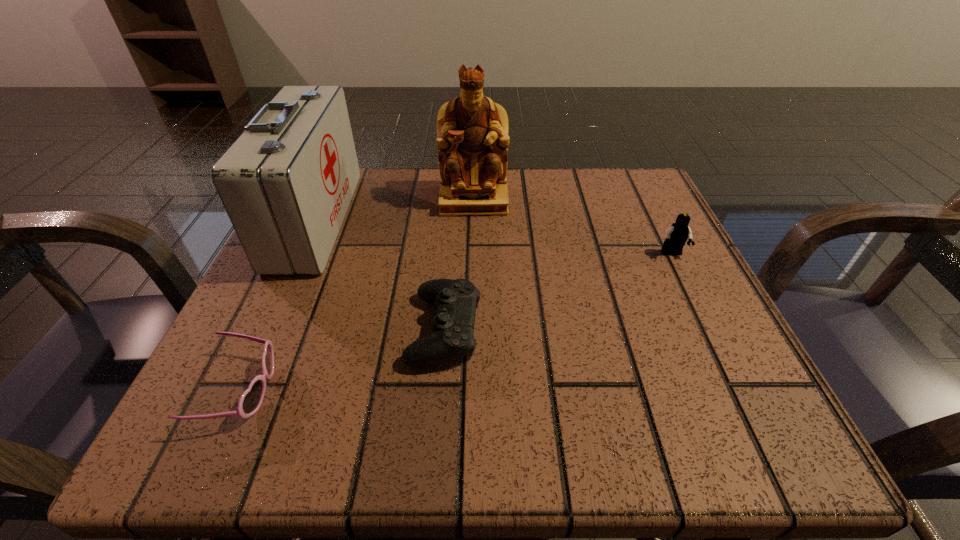
Find the location of a particular element. This screenshot has height=540, width=960. free space located on the front-facing side of the sunglasses is located at coordinates (497, 390).

This screenshot has height=540, width=960. Identify the location of figurine that is at the far edge. (472, 138).

I want to click on the first-aid kit that is at the far edge, so click(x=286, y=183).

Image resolution: width=960 pixels, height=540 pixels. What are the coordinates of `object at the near edge` in the screenshot? It's located at (251, 400).

Locate an element on the screen. Image resolution: width=960 pixels, height=540 pixels. the first-aid kit at the left edge is located at coordinates (286, 183).

Identify the location of sunglasses located in the left edge section of the desktop. This screenshot has height=540, width=960. (251, 400).

Find the location of `object present at the right edge`. object present at the right edge is located at coordinates (676, 236).

At what (x,y) coordinates should I click in order to perform the action: click on object present at the far left corner. Please return your answer as a coordinate pair (x, y). The image size is (960, 540). Looking at the image, I should click on (286, 183).

You are a GUI agent. You are given a task and a screenshot of the screen. Output one action in this format:
    pyautogui.click(x=<x>, y=<y>)
    Task: Click on the object at the near left corner
    The width and height of the screenshot is (960, 540).
    Given the screenshot: What is the action you would take?
    pyautogui.click(x=251, y=400)

In the image, there is a desktop. Where is `blank space at the far edge`? Image resolution: width=960 pixels, height=540 pixels. blank space at the far edge is located at coordinates (566, 187).